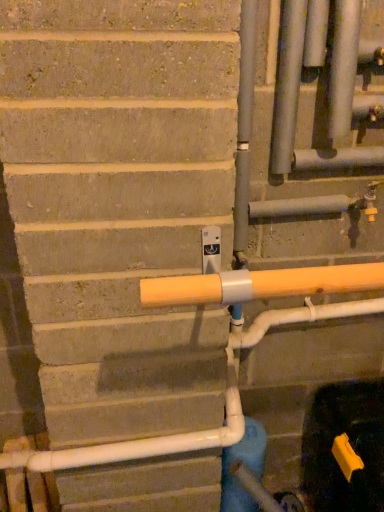
This screenshot has height=512, width=384. Find the location of `matte silver pipe at upper right, the 2th pipe when ordered from left to right`. matte silver pipe at upper right, the 2th pipe when ordered from left to right is located at coordinates (343, 67).

Who is taller, blue matte water pipe at lower center or satin silver pipes at upper right, placed as the 1th pipe when sorted from left to right?

blue matte water pipe at lower center.

Considering the positions of objects blue matte water pipe at lower center and satin silver pipes at upper right, placed as the 1th pipe when sorted from left to right, in the image provided, who is more to the right, blue matte water pipe at lower center or satin silver pipes at upper right, placed as the 1th pipe when sorted from left to right,?

From the viewer's perspective, satin silver pipes at upper right, placed as the 1th pipe when sorted from left to right, appears more on the right side.

Is satin silver pipes at upper right, placed as the 1th pipe when sorted from left to right, inside blue matte water pipe at lower center?

No, satin silver pipes at upper right, placed as the 1th pipe when sorted from left to right, is not a part of blue matte water pipe at lower center.

What's the angular difference between blue matte water pipe at lower center and matte silver pipe at upper right, arranged as the 1th pipe when viewed from the right,'s facing directions?

The facing directions of blue matte water pipe at lower center and matte silver pipe at upper right, arranged as the 1th pipe when viewed from the right, are 3.83 degrees apart.

Is blue matte water pipe at lower center to the left of matte silver pipe at upper right, the 2th pipe when ordered from left to right, from the viewer's perspective?

Correct, you'll find blue matte water pipe at lower center to the left of matte silver pipe at upper right, the 2th pipe when ordered from left to right.

Where is `water pipe behind the matte silver pipe at upper right, arranged as the 1th pipe when viewed from the right`? water pipe behind the matte silver pipe at upper right, arranged as the 1th pipe when viewed from the right is located at coordinates (245, 464).

Relative to blue matte water pipe at lower center, is matte silver pipe at upper right, arranged as the 1th pipe when viewed from the right, in front or behind?

matte silver pipe at upper right, arranged as the 1th pipe when viewed from the right, is positioned closer to the viewer than blue matte water pipe at lower center.

From the image's perspective, is matte silver pipe at upper right, the 2th pipe when ordered from left to right, located above or below blue matte water pipe at lower center?

Clearly, from the image's perspective, matte silver pipe at upper right, the 2th pipe when ordered from left to right, is above blue matte water pipe at lower center.

Does matte silver pipe at upper right, the 2th pipe when ordered from left to right, have a lesser width compared to blue matte water pipe at lower center?

Correct, the width of matte silver pipe at upper right, the 2th pipe when ordered from left to right, is less than that of blue matte water pipe at lower center.

Is matte silver pipe at upper right, arranged as the 1th pipe when viewed from the right, oriented away from satin silver pipes at upper right, marked as the second pipe in a right-to-left arrangement?

matte silver pipe at upper right, arranged as the 1th pipe when viewed from the right, does not have its back to satin silver pipes at upper right, marked as the second pipe in a right-to-left arrangement.

Does point (334, 86) come closer to viewer compared to point (277, 154)?

Yes, point (334, 86) is closer to viewer.

Measure the distance from matte silver pipe at upper right, arranged as the 1th pipe when viewed from the right, to satin silver pipes at upper right, placed as the 1th pipe when sorted from left to right.

They are 4.02 inches apart.

Does matte silver pipe at upper right, arranged as the 1th pipe when viewed from the right, have a greater width compared to satin silver pipes at upper right, marked as the second pipe in a right-to-left arrangement?

Yes.

In terms of height, does satin silver pipes at upper right, marked as the second pipe in a right-to-left arrangement, look taller or shorter compared to blue matte water pipe at lower center?

Considering their sizes, satin silver pipes at upper right, marked as the second pipe in a right-to-left arrangement, has less height than blue matte water pipe at lower center.

Which is behind, point (293, 87) or point (243, 506)?

The point (243, 506) is behind.

From a real-world perspective, is satin silver pipes at upper right, marked as the second pipe in a right-to-left arrangement, positioned above or below blue matte water pipe at lower center?

satin silver pipes at upper right, marked as the second pipe in a right-to-left arrangement, is above blue matte water pipe at lower center.

Which object is positioned more to the right, satin silver pipes at upper right, placed as the 1th pipe when sorted from left to right, or blue matte water pipe at lower center?

Positioned to the right is satin silver pipes at upper right, placed as the 1th pipe when sorted from left to right.

Consider the image. Is satin silver pipes at upper right, marked as the second pipe in a right-to-left arrangement, spatially inside matte silver pipe at upper right, arranged as the 1th pipe when viewed from the right, or outside of it?

The correct answer is: outside.

Is satin silver pipes at upper right, placed as the 1th pipe when sorted from left to right, facing towards matte silver pipe at upper right, arranged as the 1th pipe when viewed from the right?

No, satin silver pipes at upper right, placed as the 1th pipe when sorted from left to right, does not turn towards matte silver pipe at upper right, arranged as the 1th pipe when viewed from the right.

Is point (297, 106) closer to camera compared to point (338, 86)?

No, (297, 106) is further to viewer.

Considering the positions of objects satin silver pipes at upper right, marked as the second pipe in a right-to-left arrangement, and matte silver pipe at upper right, arranged as the 1th pipe when viewed from the right, in the image provided, who is in front, satin silver pipes at upper right, marked as the second pipe in a right-to-left arrangement, or matte silver pipe at upper right, arranged as the 1th pipe when viewed from the right,?

matte silver pipe at upper right, arranged as the 1th pipe when viewed from the right.

Where is `water pipe located behind the satin silver pipes at upper right, placed as the 1th pipe when sorted from left to right`? water pipe located behind the satin silver pipes at upper right, placed as the 1th pipe when sorted from left to right is located at coordinates (245, 464).

You are a GUI agent. You are given a task and a screenshot of the screen. Output one action in this format:
    pyautogui.click(x=<x>, y=<y>)
    Task: Click on the water pipe that is on the left side of matte silver pipe at upper right, arranged as the 1th pipe when viewed from the right
    The image size is (384, 512).
    Given the screenshot: What is the action you would take?
    pyautogui.click(x=245, y=464)

Based on their spatial positions, is satin silver pipes at upper right, marked as the second pipe in a right-to-left arrangement, or matte silver pipe at upper right, arranged as the 1th pipe when viewed from the right, closer to blue matte water pipe at lower center?

satin silver pipes at upper right, marked as the second pipe in a right-to-left arrangement.

From the image, which object appears to be farther from matte silver pipe at upper right, the 2th pipe when ordered from left to right, blue matte water pipe at lower center or satin silver pipes at upper right, placed as the 1th pipe when sorted from left to right?

Among the two, blue matte water pipe at lower center is located further to matte silver pipe at upper right, the 2th pipe when ordered from left to right.

Looking at the image, which one is located closer to satin silver pipes at upper right, placed as the 1th pipe when sorted from left to right, matte silver pipe at upper right, the 2th pipe when ordered from left to right, or blue matte water pipe at lower center?

matte silver pipe at upper right, the 2th pipe when ordered from left to right, is closer to satin silver pipes at upper right, placed as the 1th pipe when sorted from left to right.

Estimate the real-world distances between objects in this image. Which object is further from matte silver pipe at upper right, arranged as the 1th pipe when viewed from the right, satin silver pipes at upper right, placed as the 1th pipe when sorted from left to right, or blue matte water pipe at lower center?

Among the two, blue matte water pipe at lower center is located further to matte silver pipe at upper right, arranged as the 1th pipe when viewed from the right.

Looking at the image, which one is located closer to blue matte water pipe at lower center, matte silver pipe at upper right, arranged as the 1th pipe when viewed from the right, or satin silver pipes at upper right, placed as the 1th pipe when sorted from left to right?

satin silver pipes at upper right, placed as the 1th pipe when sorted from left to right.

Estimate the real-world distances between objects in this image. Which object is closer to satin silver pipes at upper right, placed as the 1th pipe when sorted from left to right, blue matte water pipe at lower center or matte silver pipe at upper right, the 2th pipe when ordered from left to right?

matte silver pipe at upper right, the 2th pipe when ordered from left to right, is positioned closer to the anchor satin silver pipes at upper right, placed as the 1th pipe when sorted from left to right.

Find the location of a particular element. pipe between matte silver pipe at upper right, arranged as the 1th pipe when viewed from the right, and blue matte water pipe at lower center vertically is located at coordinates (287, 85).